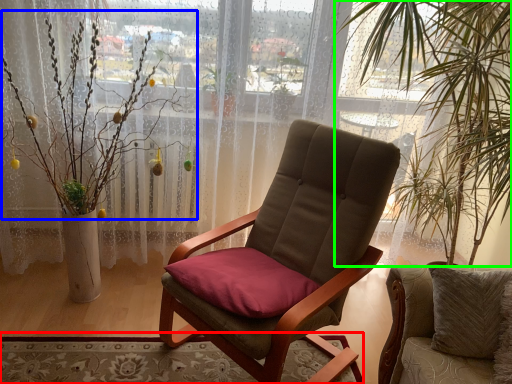
Question: Based on their relative distances, which object is farther from mat (highlighted by a red box)? Choose from floral arrangement (highlighted by a blue box) and vegetation (highlighted by a green box).

Choices:
 (A) floral arrangement
 (B) vegetation

Answer: (B)